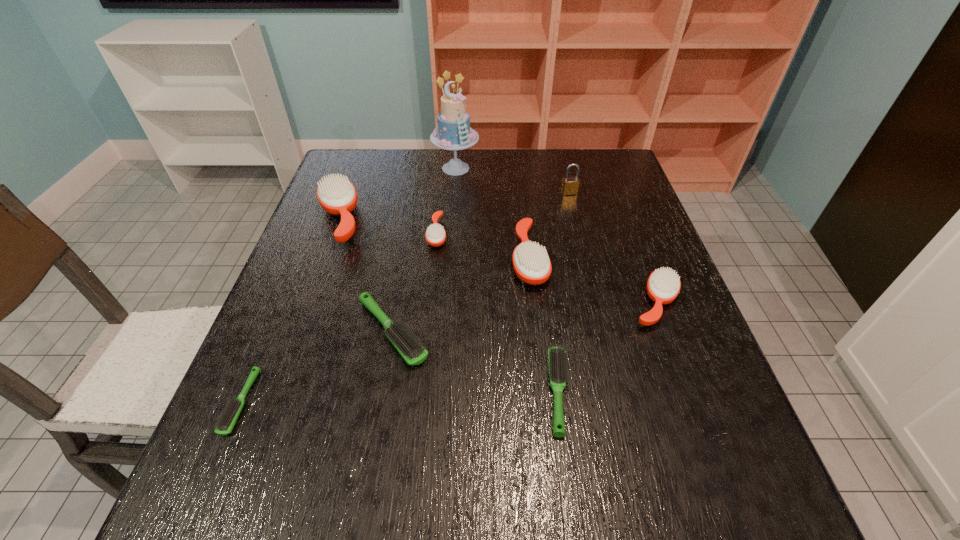
In order to click on vacant space at the left edge in this screenshot , I will do `click(319, 242)`.

Where is `vacant position at the right edge of the desktop`? This screenshot has width=960, height=540. vacant position at the right edge of the desktop is located at coordinates (660, 252).

Identify the location of free space at the far left corner. (373, 169).

Locate an element on the screen. This screenshot has height=540, width=960. vacant area at the far right corner is located at coordinates (613, 152).

Locate an element on the screen. This screenshot has width=960, height=540. free spot between the smallest orange hairbrush and the biggest light hairbrush is located at coordinates (415, 282).

Find the location of a particular element. free area in between the second biggest orange hairbrush and the eighth object from left to right is located at coordinates (549, 226).

At what (x,y) coordinates should I click in order to perform the action: click on free spot between the second biggest orange hairbrush and the biggest light hairbrush. Please return your answer as a coordinate pair (x, y). The height and width of the screenshot is (540, 960). Looking at the image, I should click on (461, 295).

Image resolution: width=960 pixels, height=540 pixels. What are the coordinates of `free spot between the second orange hairbrush from left to right and the sixth shortest object` in the screenshot? It's located at (483, 246).

Identify the location of vacant area between the sixth shortest hairbrush and the eighth shortest object. (549, 226).

Identify the location of empty space between the third biggest orange hairbrush and the shortest hairbrush. (448, 353).